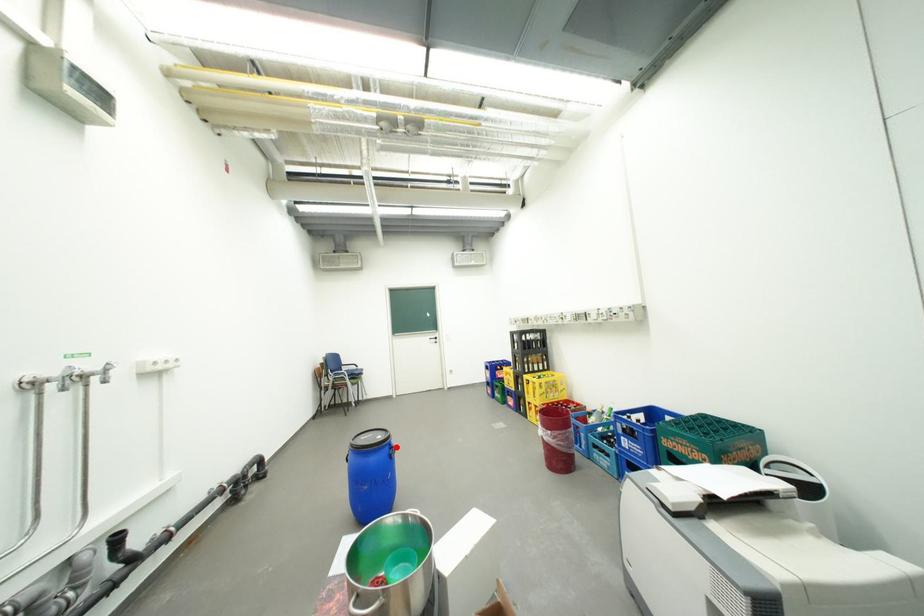
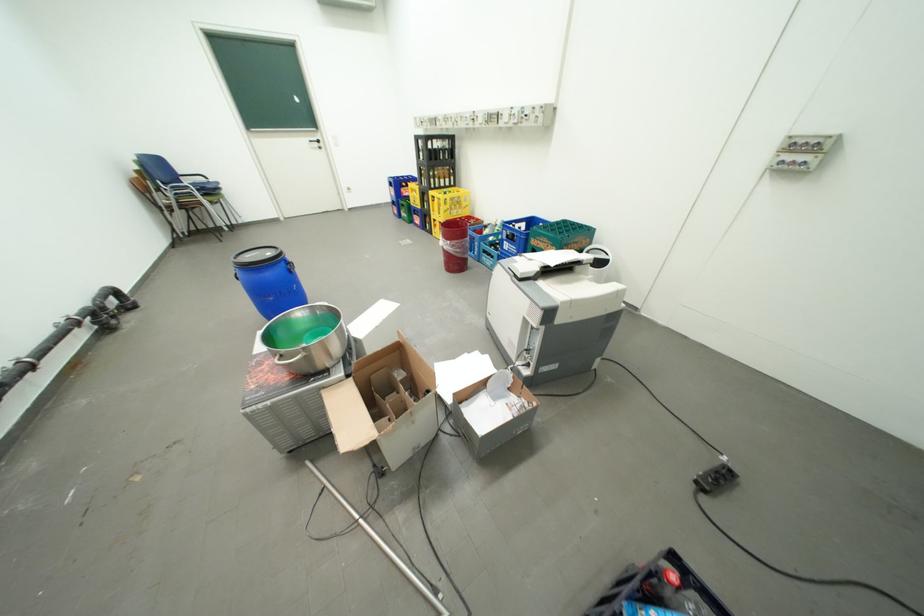
In the second image, find the point that corresponds to the highlighted location in the first image.

(290, 262)